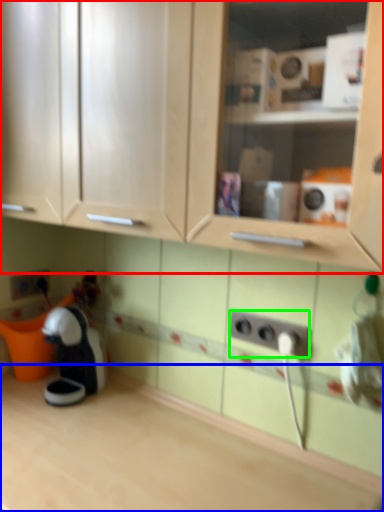
Question: Which object is positioned farthest from cabinetry (highlighted by a red box)? Select from countertop (highlighted by a blue box) and electric outlet (highlighted by a green box).

Choices:
 (A) countertop
 (B) electric outlet

Answer: (A)